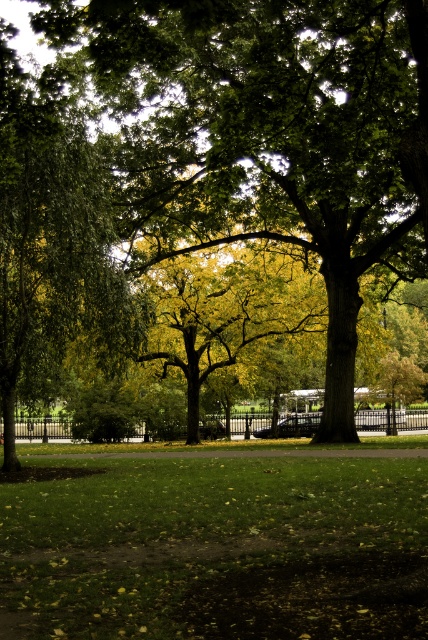
You are a gardener who needs to water both the green leafy tree at center and the green grass at center. You have a water hose that can reach 25 feet. Can you water both without moving the hose? Please explain your reasoning.

The green leafy tree at center and green grass at center are 27.60 feet apart. Since the hose can only reach 25 feet, you cannot water both without moving the hose because the distance between them exceeds the hose length.